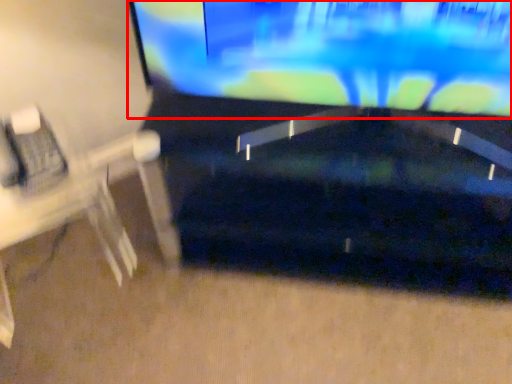
Question: From the image's perspective, considering the relative positions of television (annotated by the red box) and computer desk in the image provided, where is television (annotated by the red box) located with respect to the staircase?

Choices:
 (A) above
 (B) below

Answer: (A)